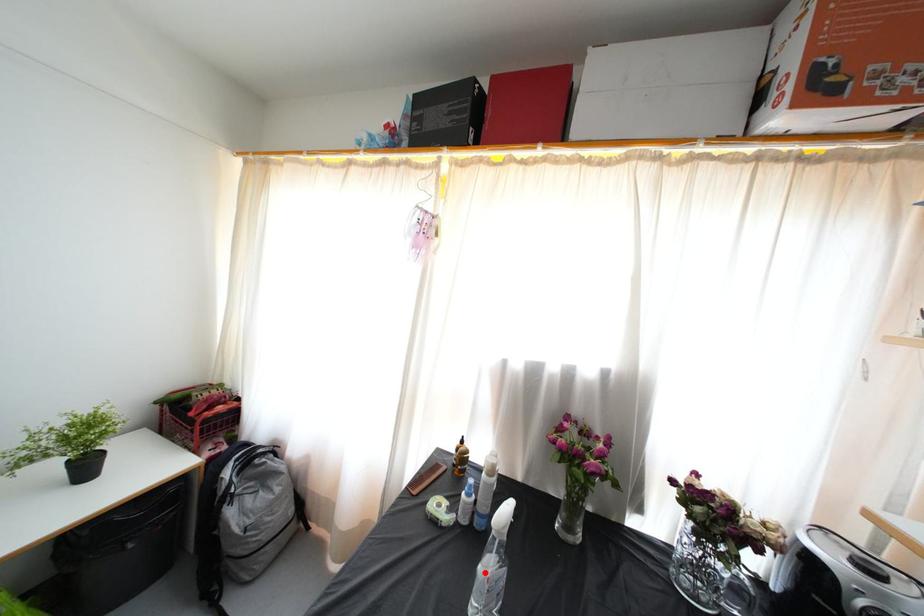
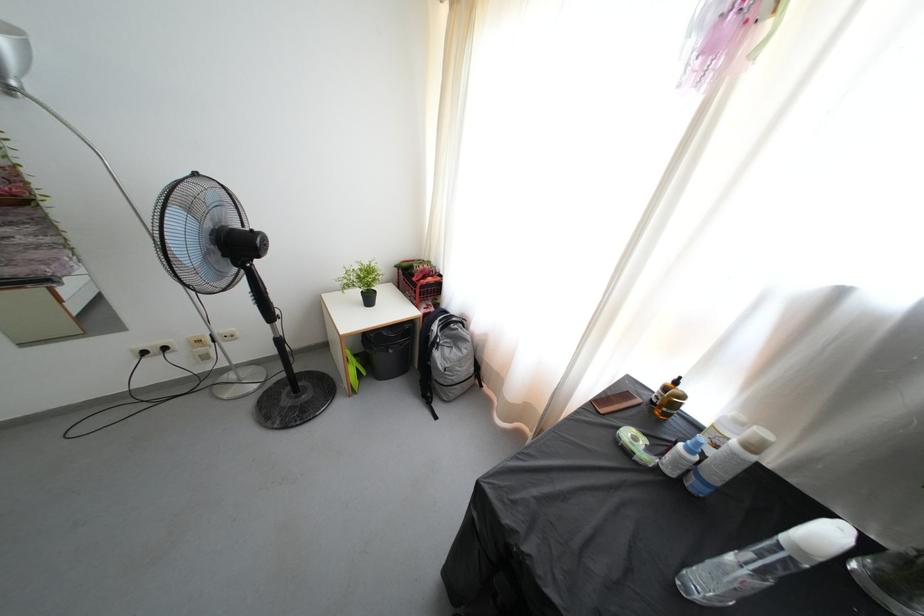
Where in the second image is the point corresponding to the highlighted location from the first image?

(736, 564)